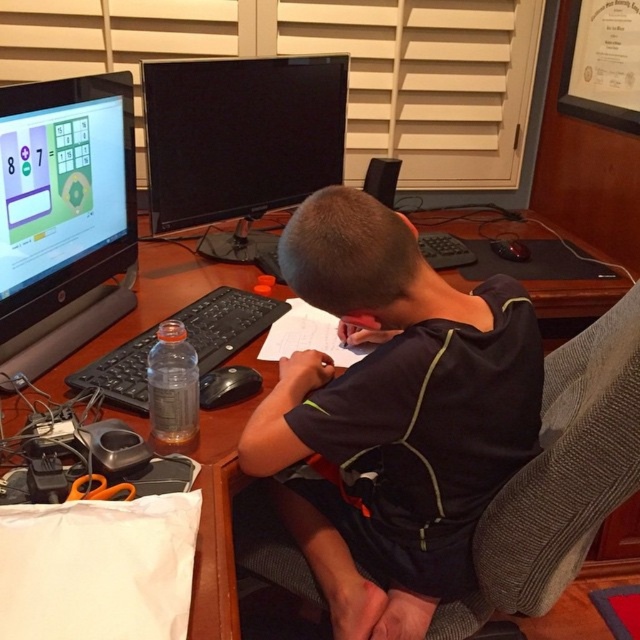
Question: Where is dark blue jersey at center located in relation to brown wooden computer desk at center in the image?

Choices:
 (A) left
 (B) right

Answer: (B)

Question: Is black glossy monitor at center to the right of black plastic keyboard at center from the viewer's perspective?

Choices:
 (A) yes
 (B) no

Answer: (A)

Question: Based on their relative distances, which object is nearer to the brown wooden computer desk at center?

Choices:
 (A) matte black monitor at left
 (B) black glossy monitor at center

Answer: (A)

Question: Considering the relative positions of dark blue jersey at center and black glossy monitor at center in the image provided, where is dark blue jersey at center located with respect to black glossy monitor at center?

Choices:
 (A) left
 (B) right

Answer: (B)

Question: Which point appears farthest from the camera in this image?

Choices:
 (A) tap(170, 252)
 (B) tap(273, 244)
 (C) tap(326, 378)

Answer: (B)

Question: Which of the following is the closest to the observer?

Choices:
 (A) brown wooden computer desk at center
 (B) black plastic keyboard at center

Answer: (A)